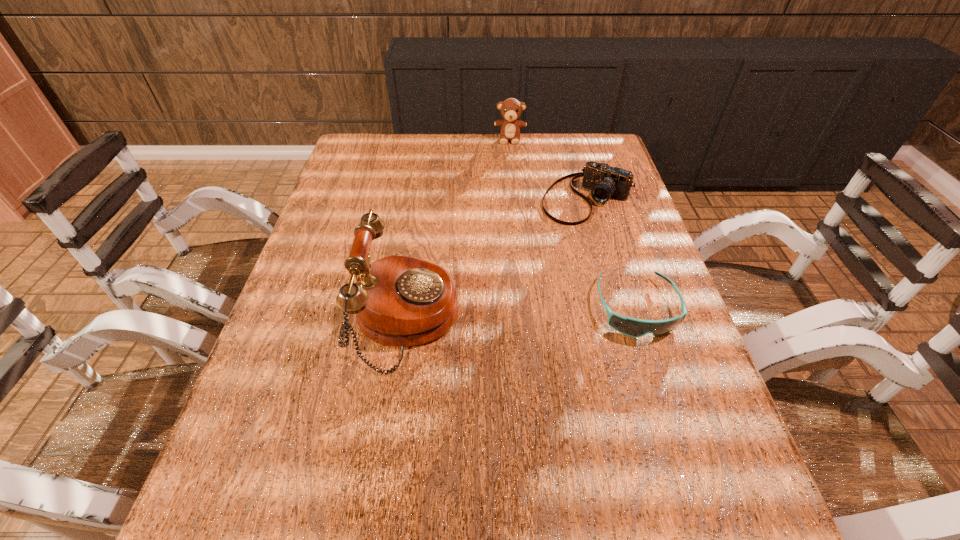
You are a GUI agent. You are given a task and a screenshot of the screen. Output one action in this format:
    pyautogui.click(x=<x>, y=<y>)
    Task: Click on the free space on the desktop that is between the leftmost object and the sunglasses and is positioned on the front-facing side of the camera
    
    Given the screenshot: What is the action you would take?
    pyautogui.click(x=489, y=315)

This screenshot has width=960, height=540. I want to click on vacant space on the desktop that is between the telephone and the sunglasses and is positioned on the face of the farthest object, so click(x=504, y=314).